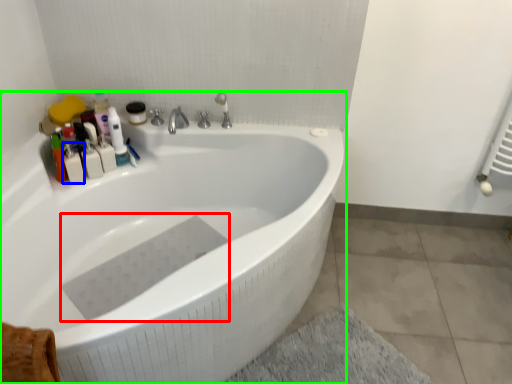
Question: Which object is the farthest from bath towel (highlighted by a red box)? Choose among these: toiletry (highlighted by a blue box) or bathtub (highlighted by a green box).

Choices:
 (A) toiletry
 (B) bathtub

Answer: (A)